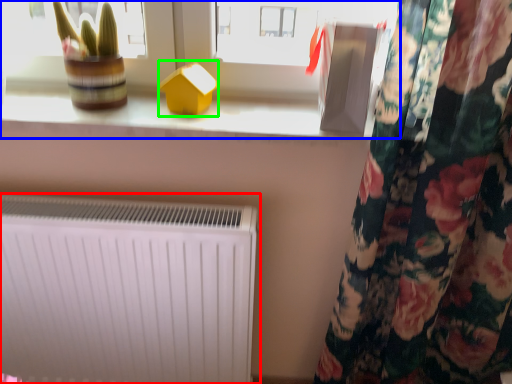
Question: Based on their relative distances, which object is nearer to radiator (highlighted by a red box)? Choose from window (highlighted by a blue box) and toy (highlighted by a green box).

Choices:
 (A) window
 (B) toy

Answer: (A)